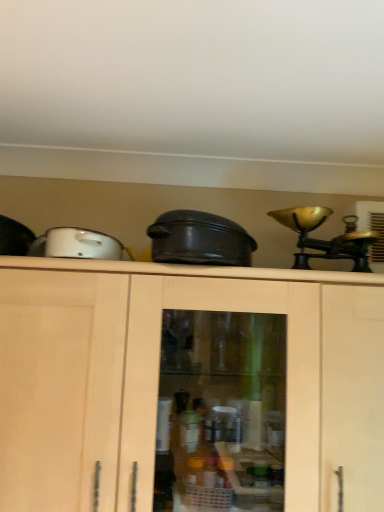
Question: In terms of width, does white glossy toaster at upper left look wider or thinner when compared to black matte crock pot at center?

Choices:
 (A) thin
 (B) wide

Answer: (A)

Question: Considering the positions of white glossy toaster at upper left and black matte crock pot at center in the image, is white glossy toaster at upper left taller or shorter than black matte crock pot at center?

Choices:
 (A) tall
 (B) short

Answer: (B)

Question: In the image, is white glossy toaster at upper left positioned in front of or behind black matte crock pot at center?

Choices:
 (A) front
 (B) behind

Answer: (A)

Question: Does point (188, 234) appear closer or farther from the camera than point (62, 233)?

Choices:
 (A) closer
 (B) farther

Answer: (A)

Question: From a real-world perspective, relative to white glossy toaster at upper left, is black matte crock pot at center vertically above or below?

Choices:
 (A) below
 (B) above

Answer: (B)

Question: From the image's perspective, is black matte crock pot at center located above or below white glossy toaster at upper left?

Choices:
 (A) below
 (B) above

Answer: (A)

Question: In the image, is black matte crock pot at center positioned in front of or behind white glossy toaster at upper left?

Choices:
 (A) front
 (B) behind

Answer: (B)